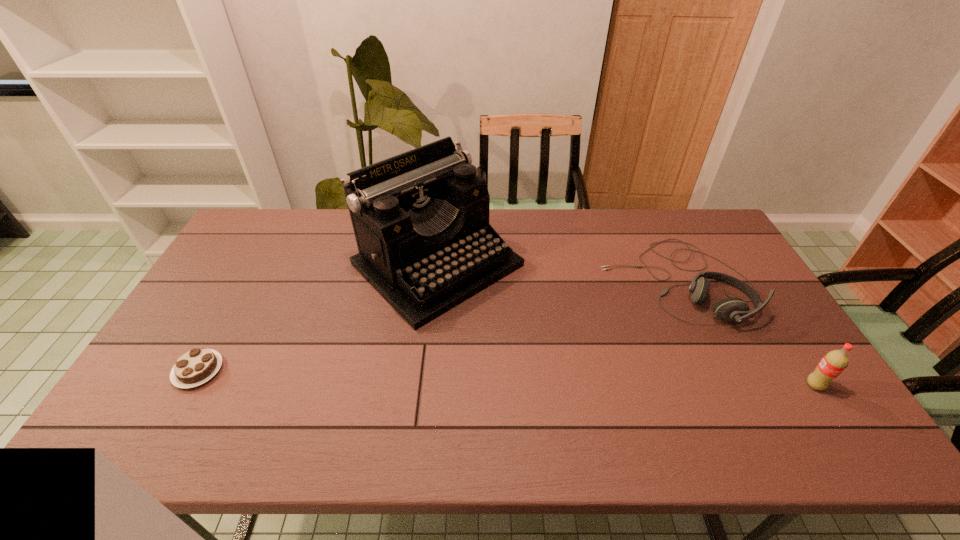
Identify the location of headset that is at the right edge. Image resolution: width=960 pixels, height=540 pixels. (728, 309).

I want to click on object positioned at the near left corner, so click(x=197, y=366).

This screenshot has height=540, width=960. What are the coordinates of `object situated at the far right corner` in the screenshot? It's located at (728, 309).

Image resolution: width=960 pixels, height=540 pixels. Find the location of `object at the near right corner`. object at the near right corner is located at coordinates (834, 362).

Find the location of a particular element. The image size is (960, 540). vacant region at the far edge of the desktop is located at coordinates (633, 218).

This screenshot has width=960, height=540. I want to click on vacant position at the left edge of the desktop, so (210, 281).

The width and height of the screenshot is (960, 540). Find the location of `free space at the right edge of the desktop`. free space at the right edge of the desktop is located at coordinates (795, 367).

In the image, there is a desktop. Where is `vacant space at the near left corner`? The width and height of the screenshot is (960, 540). vacant space at the near left corner is located at coordinates (141, 400).

Identify the location of vacant area at the far right corner of the desktop. (691, 218).

The height and width of the screenshot is (540, 960). In order to click on empty space that is in between the second shortest object and the soda in this screenshot , I will do `click(746, 333)`.